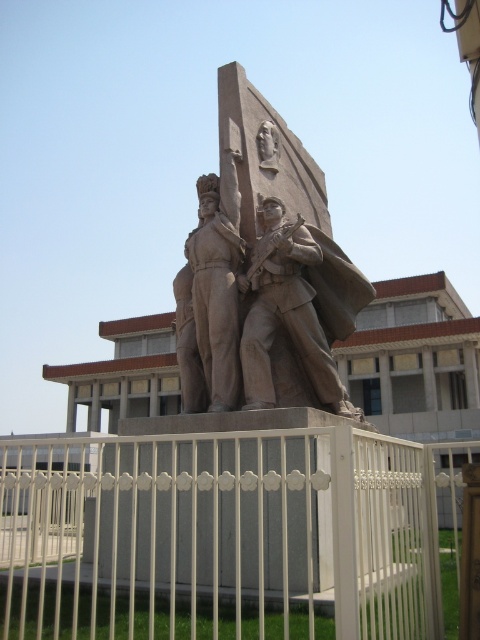
Question: Is stone statue at center further to camera compared to brown stone statue at center?

Choices:
 (A) no
 (B) yes

Answer: (A)

Question: Which of the following is the closest to the observer?

Choices:
 (A) (256, 608)
 (B) (336, 282)
 (C) (286, 388)

Answer: (A)

Question: Which of the following is the closest to the observer?

Choices:
 (A) gray stone sculpture at center
 (B) white metal fence at center
 (C) brown stone statue at center
 (D) stone statue at center

Answer: (B)

Question: Is gray stone sculpture at center below stone statue at center?

Choices:
 (A) yes
 (B) no

Answer: (B)

Question: Is the position of gray stone sculpture at center less distant than that of stone statue at center?

Choices:
 (A) yes
 (B) no

Answer: (B)

Question: Which point is farther from the camera taking this photo?

Choices:
 (A) click(217, 388)
 (B) click(216, 316)

Answer: (B)